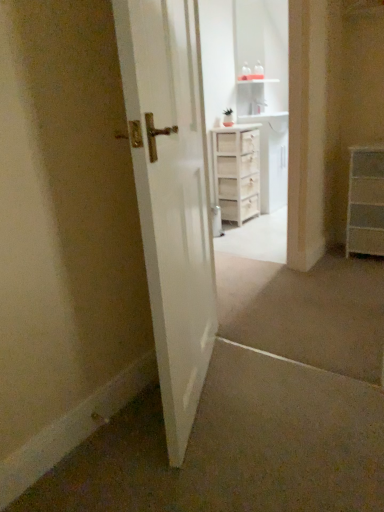
Image resolution: width=384 pixels, height=512 pixels. I want to click on blank area to the left of white matte chest of drawers at right, which appears as the 1th chest of drawers when viewed from the right, so click(339, 255).